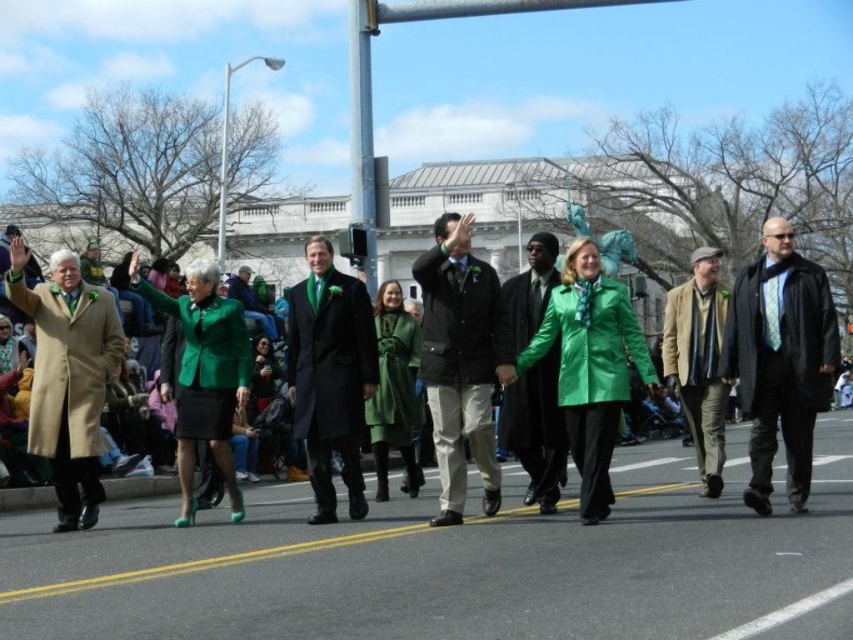
You are a photographer at the parade and want to capture both the black matte coat at right and the shiny black coat at center in a single photo. Which coat should you focus on first to ensure it appears higher in the frame?

The black matte coat at right is above the shiny black coat at center, so focusing on it first will ensure it appears higher in the frame.

You are standing on the parade route and see two points marked in the scene. Which point is closer to you, point (434,454) or point (82,292)?

Point (434,454) is further to the viewer than point (82,292), so the closer point to you is point (82,292).